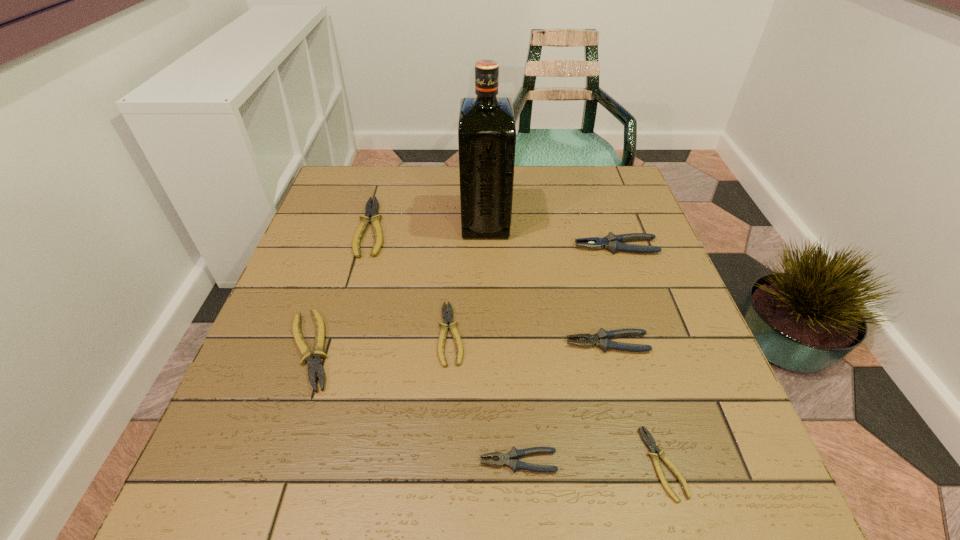
Locate an element on the screen. The height and width of the screenshot is (540, 960). free space between the sixth tallest pliers and the shortest object is located at coordinates pos(557,399).

Where is `empty space that is in between the smallest gray pliers and the liquor`? The height and width of the screenshot is (540, 960). empty space that is in between the smallest gray pliers and the liquor is located at coordinates (502, 341).

Find the location of a particular element. The image size is (960, 540). vacant area that lies between the third biggest yellow pliers and the tallest object is located at coordinates (468, 278).

Find the location of a particular element. unoccupied position between the fifth pliers from right to left and the biggest yellow pliers is located at coordinates (412, 281).

Locate an element on the screen. Image resolution: width=960 pixels, height=540 pixels. free space between the liquor and the farthest yellow pliers is located at coordinates (429, 225).

Find the location of a particular element. This screenshot has width=960, height=540. free space between the biggest yellow pliers and the second farthest gray pliers is located at coordinates (490, 285).

At what (x,y) coordinates should I click in order to perform the action: click on blank region between the second biggest yellow pliers and the second yellow pliers from right to left. Please return your answer as a coordinate pair (x, y). Looking at the image, I should click on (380, 342).

Find the location of a particular element. object that stands as the closest to the biggest yellow pliers is located at coordinates (315, 366).

Identify which object is located as the seventh nearest to the farthest gray pliers. Please provide its 2D coordinates. Your answer should be formatted as a tuple, i.e. [(x, y)], where the tuple contains the x and y coordinates of a point satisfying the conditions above.

[(315, 366)]

This screenshot has height=540, width=960. I want to click on the second closest pliers to the second biggest gray pliers, so click(513, 454).